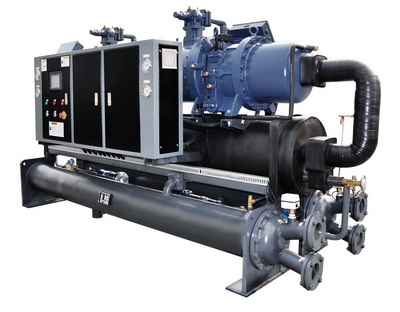
Locate an element on the screen. 2 gauges to right of right cabinet door is located at coordinates (146, 90), (159, 66).